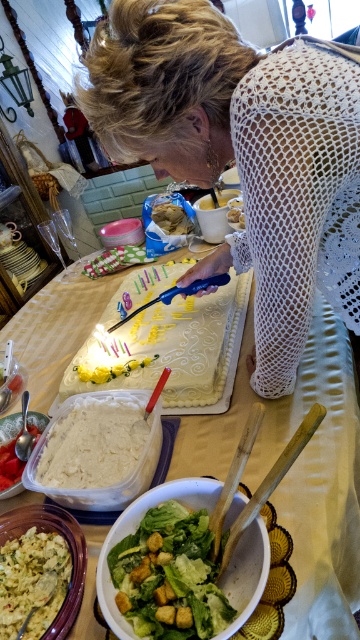
Does yellow frosted cake at center appear over yellow crumbly bread at lower left?

Correct, yellow frosted cake at center is located above yellow crumbly bread at lower left.

Does yellow frosted cake at center have a larger size compared to yellow crumbly bread at lower left?

Correct, yellow frosted cake at center is larger in size than yellow crumbly bread at lower left.

Who is more forward, (146, 316) or (43, 611)?

Point (43, 611) is in front.

This screenshot has width=360, height=640. What are the coordinates of `yellow frosted cake at center` in the screenshot? It's located at (177, 349).

Is white creamy mashed potatoes at center positioned behind yellow crumbly bread at lower left?

Yes, white creamy mashed potatoes at center is further from the viewer.

Which is more to the left, white creamy mashed potatoes at center or yellow crumbly bread at lower left?

Positioned to the left is yellow crumbly bread at lower left.

The image size is (360, 640). I want to click on white creamy mashed potatoes at center, so click(x=87, y=461).

Find the location of `white mesh dress at center`. white mesh dress at center is located at coordinates (244, 154).

Who is positioned more to the left, white mesh dress at center or green crouton salad at center?

Positioned to the left is green crouton salad at center.

Where is `white mesh dress at center`? white mesh dress at center is located at coordinates (244, 154).